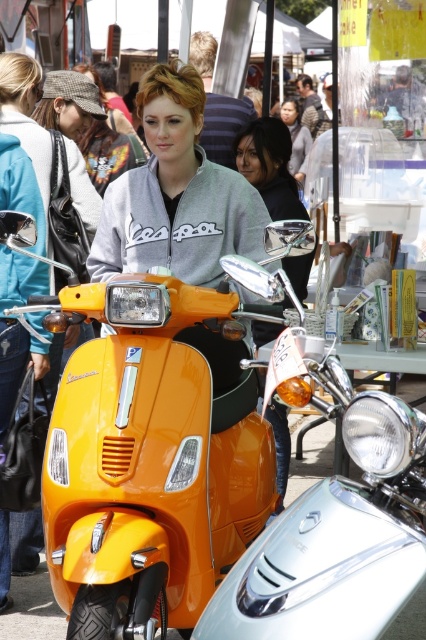
Between matte orange scooter at center and matte gray sweater at center, which one is positioned higher?

matte gray sweater at center is higher up.

Which is more to the right, matte orange scooter at center or matte gray sweater at center?

matte gray sweater at center is more to the right.

Does point (288, 208) lie behind point (302, 138)?

No, it is not.

Find the location of a particular element. The image size is (426, 640). matte orange scooter at center is located at coordinates (270, 166).